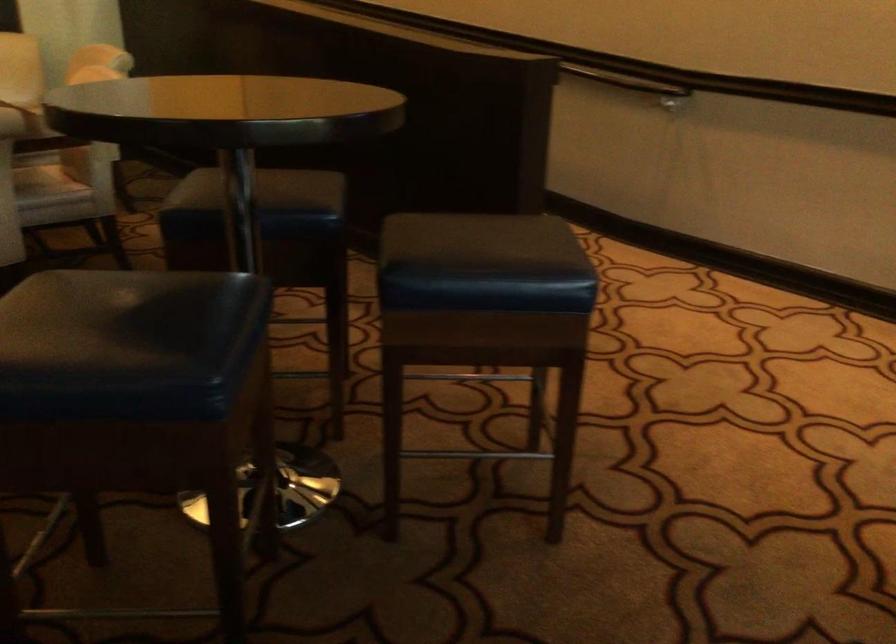
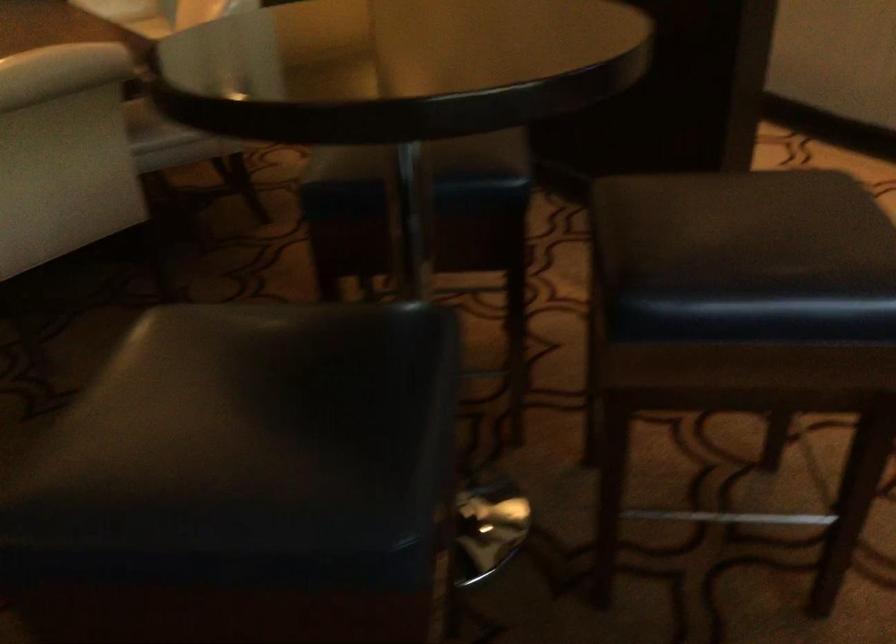
Locate, in the second image, the point that corresponds to (478,257) in the first image.

(745, 257)